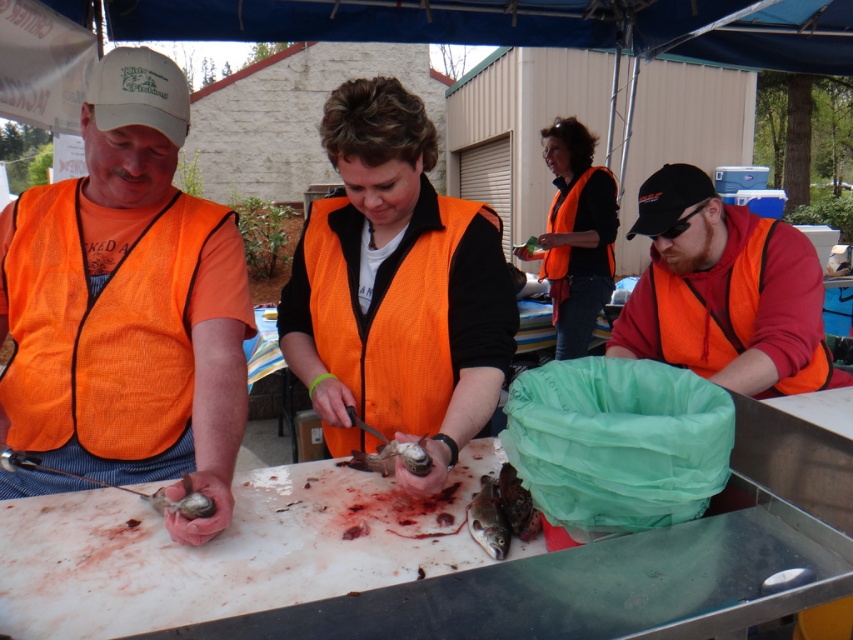
Based on the photo, can you confirm if orange mesh vest at center is shorter than shiny silver fish at center?

No, orange mesh vest at center is not shorter than shiny silver fish at center.

Is point (422, 307) closer to camera compared to point (372, 456)?

No, it is behind (372, 456).

This screenshot has height=640, width=853. What are the coordinates of `orange mesh vest at center` in the screenshot? It's located at (404, 307).

I want to click on orange mesh safety vest at left, so point(100,326).

Who is higher up, orange mesh safety vest at left or orange fabric life jacket at upper center?

orange fabric life jacket at upper center

Who is more forward, (169,435) or (589,205)?

Positioned in front is point (169,435).

This screenshot has height=640, width=853. In order to click on orange mesh safety vest at left in this screenshot , I will do `click(100, 326)`.

Can you confirm if orange mesh vest at center is smaller than orange fabric vest at right?

Yes, orange mesh vest at center is smaller than orange fabric vest at right.

Who is more forward, (451, 372) or (714, 348)?

Point (451, 372) is in front.

Where is `orange mesh vest at center`? orange mesh vest at center is located at coordinates (404, 307).